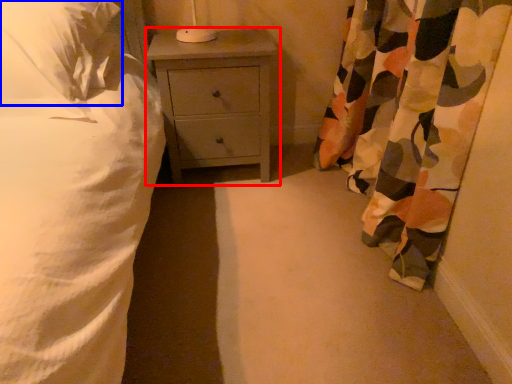
Question: Which of the following is the farthest to the observer, nightstand (highlighted by a red box) or pillow (highlighted by a blue box)?

Choices:
 (A) nightstand
 (B) pillow

Answer: (A)